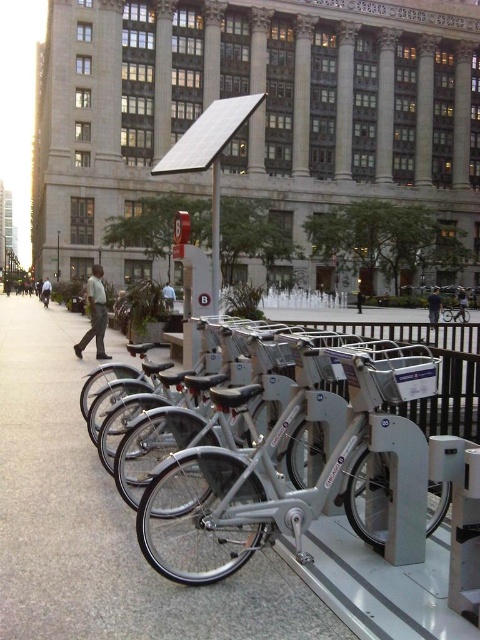
Who is lower down, dark gray shirt at center or black fabric person at center?

dark gray shirt at center

How far apart are dark gray shirt at center and black fabric person at center?

dark gray shirt at center is 8.67 meters away from black fabric person at center.

Who is more forward, (x=439, y=310) or (x=359, y=291)?

Point (x=439, y=310)

The height and width of the screenshot is (640, 480). I want to click on dark gray shirt at center, so click(433, 305).

Is dark gray pants at center thinner than black fabric person at center?

No.

Who is lower down, dark gray pants at center or black fabric person at center?

Positioned lower is dark gray pants at center.

Does point (458, 307) come in front of point (360, 296)?

Yes, it is.

Identify the location of dark gray pants at center. The width and height of the screenshot is (480, 640). (462, 304).

Does dark gray shirt at center have a larger size compared to dark gray pants at center?

Indeed, dark gray shirt at center has a larger size compared to dark gray pants at center.

Does dark gray shirt at center have a smaller size compared to dark gray pants at center?

No, dark gray shirt at center is not smaller than dark gray pants at center.

Who is more forward, [434,314] or [462,314]?

Point [434,314] is in front.

You are a GUI agent. You are given a task and a screenshot of the screen. Output one action in this format:
    pyautogui.click(x=<x>, y=<y>)
    Task: Click on the dark gray shirt at center
    
    Given the screenshot: What is the action you would take?
    pyautogui.click(x=433, y=305)